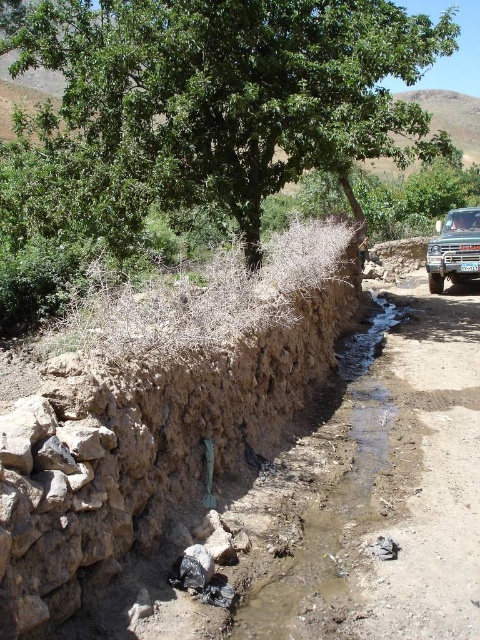
The width and height of the screenshot is (480, 640). I want to click on green leafy tree at upper center, so click(233, 88).

Is green leafy tree at upper center smaller than metallic silver truck at right?

No, green leafy tree at upper center is not smaller than metallic silver truck at right.

At what (x,y) coordinates should I click in order to perform the action: click on green leafy tree at upper center. Please return your answer as a coordinate pair (x, y). Looking at the image, I should click on (233, 88).